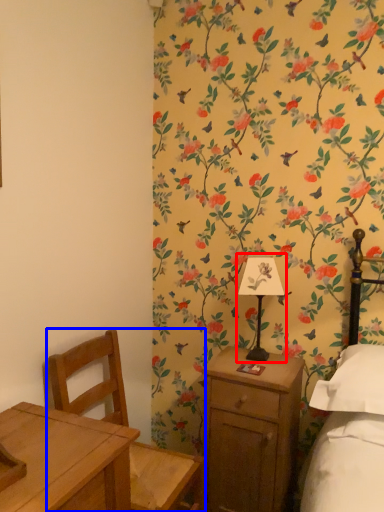
Question: Which point is further to the camera, bedside lamp (highlighted by a red box) or chair (highlighted by a blue box)?

Choices:
 (A) bedside lamp
 (B) chair

Answer: (A)